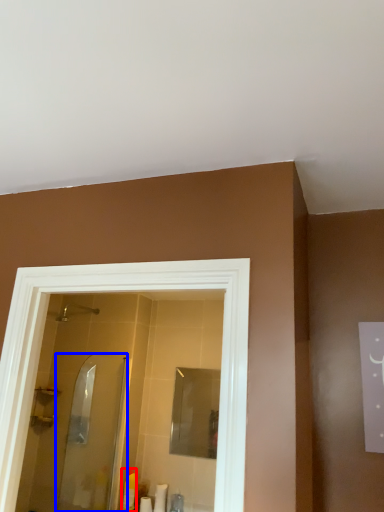
Question: Among these objects, which one is farthest to the camera, toiletry (highlighted by a red box) or screen door (highlighted by a blue box)?

Choices:
 (A) toiletry
 (B) screen door

Answer: (A)